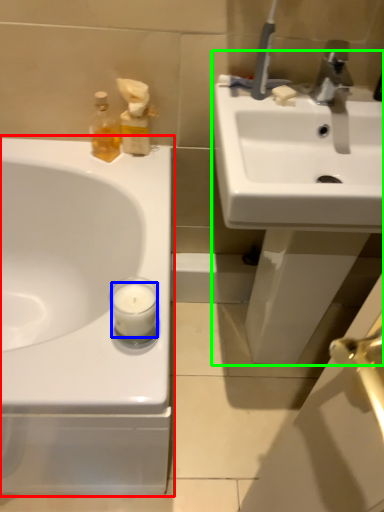
Question: Estimate the real-world distances between objects in this image. Which object is farther from sink (highlighted by a red box), candle (highlighted by a blue box) or sink (highlighted by a green box)?

Choices:
 (A) candle
 (B) sink

Answer: (B)